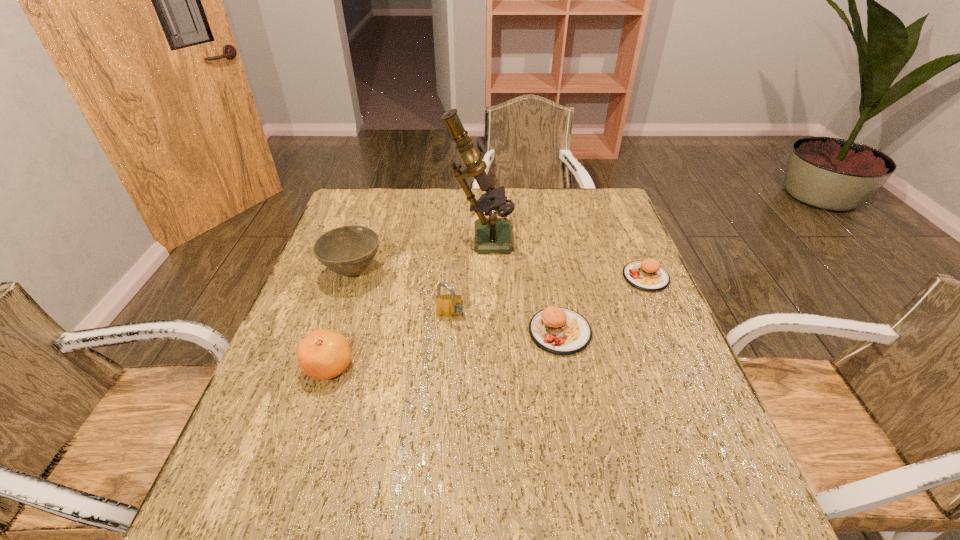
Where is `blank region between the tallest object and the second object from right to left`? This screenshot has width=960, height=540. blank region between the tallest object and the second object from right to left is located at coordinates (519, 284).

This screenshot has width=960, height=540. In order to click on vacant space in between the bowl and the padlock in this screenshot , I will do `click(401, 294)`.

Identify the location of empty space that is in between the shortest object and the microscope. Image resolution: width=960 pixels, height=540 pixels. pyautogui.click(x=563, y=256).

Point out which object is positioned as the fourth nearest to the bowl. Please provide its 2D coordinates. Your answer should be formatted as a tuple, i.e. [(x, y)], where the tuple contains the x and y coordinates of a point satisfying the conditions above.

[(561, 331)]

Find the location of a particular element. The width and height of the screenshot is (960, 540). object that stands as the third closest to the microscope is located at coordinates (449, 305).

Where is `vacant area that satisfies the following two spatial constraints: 1. at the eyepiece of the shorter patty; 2. on the left side of the tallest object`? The width and height of the screenshot is (960, 540). vacant area that satisfies the following two spatial constraints: 1. at the eyepiece of the shorter patty; 2. on the left side of the tallest object is located at coordinates (480, 277).

At what (x,y) coordinates should I click in order to perform the action: click on vacant space that satisfies the following two spatial constraints: 1. at the eyepiece of the tallest object; 2. on the left side of the taller patty. Please return your answer as a coordinate pair (x, y). Image resolution: width=960 pixels, height=540 pixels. Looking at the image, I should click on (480, 332).

Identify the location of free space that satisfies the following two spatial constraints: 1. at the eyepiece of the tallest object; 2. on the right side of the taller patty. (480, 332).